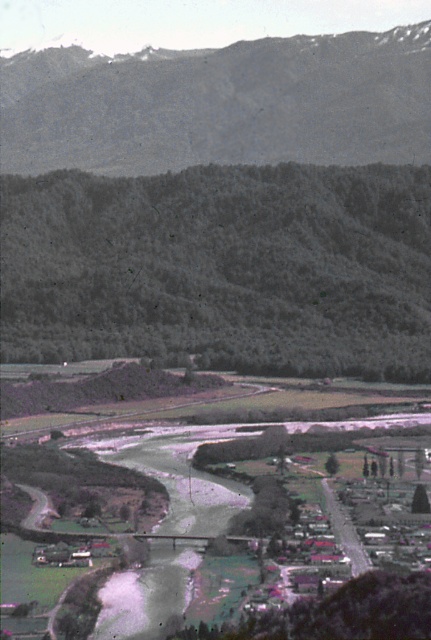
You are standing at point A and want to reach the dark green forested hillside at center. Which direction should you walk to get there?

You should walk towards the center of the image to reach the dark green forested hillside at center.

You are standing at the point marked as point (221,268) in the image. Looking around, what type of terrain or landscape feature is immediately under your feet?

The point (221,268) is on a dark green forested hillside at center, so the terrain under your feet is a forested hillside covered in dark green vegetation.